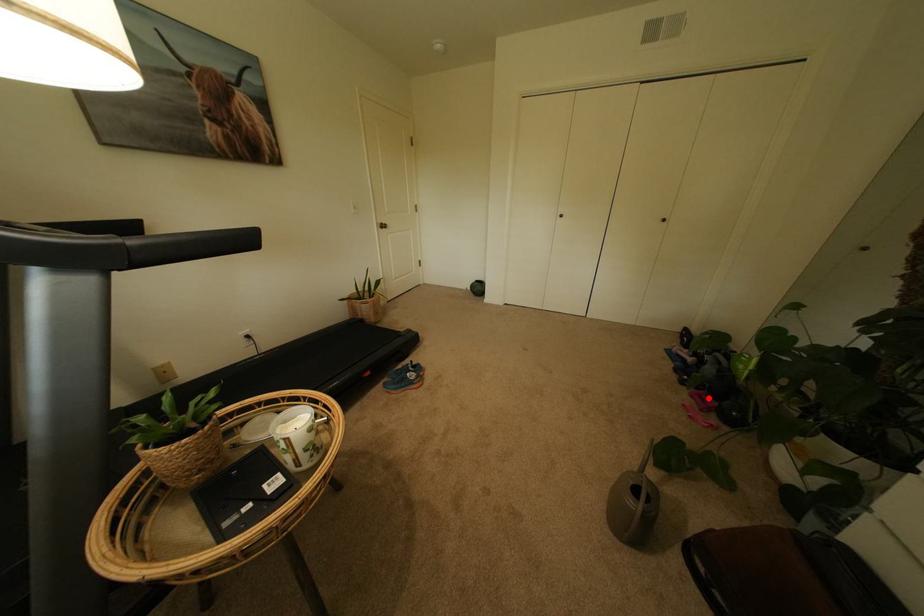
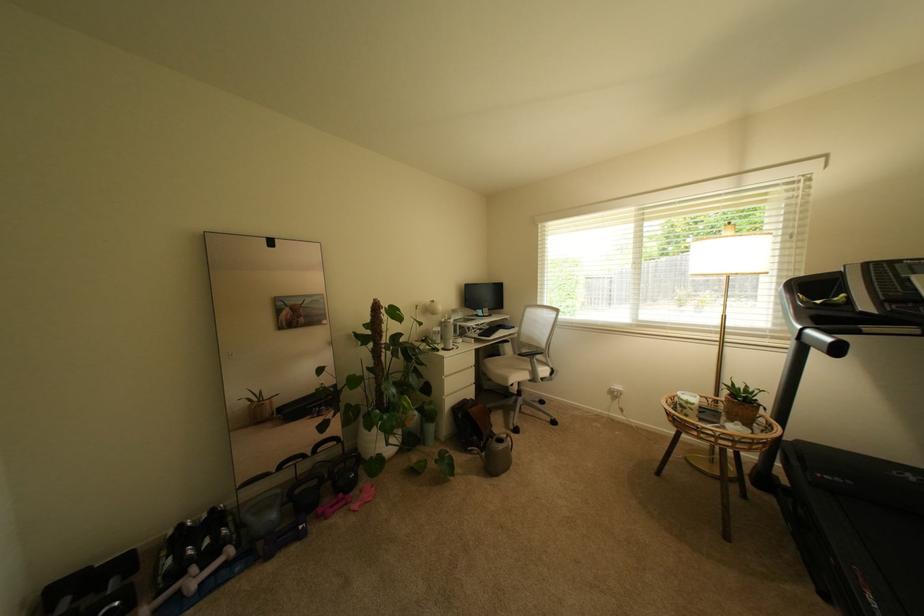
Locate, in the second image, the point that corresponds to the highlighted location in the first image.

(339, 508)